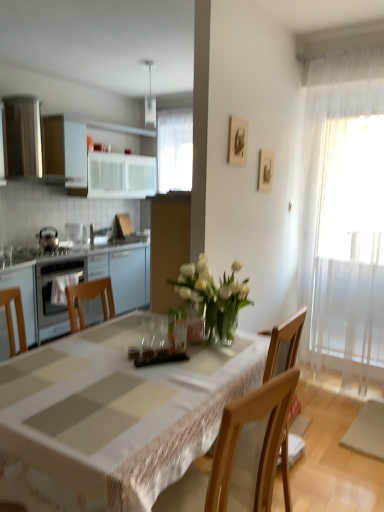
The width and height of the screenshot is (384, 512). What are the coordinates of `wooden picture frame at upper center, positioned as the 1th picture frame in left-to-right order` in the screenshot? It's located at (237, 141).

Find the location of `satin silver gas stove at left`. satin silver gas stove at left is located at coordinates (48, 251).

Identify the location of wooden chair at center. The width and height of the screenshot is (384, 512). (284, 340).

What do you see at coordinates (284, 340) in the screenshot?
I see `wooden chair at center` at bounding box center [284, 340].

This screenshot has width=384, height=512. Describe the element at coordinates (115, 415) in the screenshot. I see `white clothed table at center` at that location.

Measure the distance between white clothed table at center and camera.

1.07 meters.

This screenshot has width=384, height=512. What are the coordinates of `wooden picture frame at upper center, the 1th picture frame viewed from the front` in the screenshot? It's located at (237, 141).

From the image's perspective, which is below, wooden picture frame at upper right, the 2th picture frame when ordered from front to back, or white sheer curtain at right?

white sheer curtain at right.

Does point (265, 169) come in front of point (373, 91)?

That is True.

Which object is further away from the camera, wooden picture frame at upper right, the first picture frame in the right-to-left sequence, or white sheer curtain at right?

Positioned behind is wooden picture frame at upper right, the first picture frame in the right-to-left sequence.

Is wooden picture frame at upper right, marked as the first picture frame in a back-to-front arrangement, bigger or smaller than white sheer curtain at right?

Considering their sizes, wooden picture frame at upper right, marked as the first picture frame in a back-to-front arrangement, takes up less space than white sheer curtain at right.

Is white glass vase at center directly adjacent to satin silver oven at left?

No.

Can you confirm if white glass vase at center is wider than satin silver oven at left?

Indeed, white glass vase at center has a greater width compared to satin silver oven at left.

Is white glass vase at center positioned beyond the bounds of satin silver oven at left?

white glass vase at center lies outside satin silver oven at left's area.

Locate an element on the screen. The image size is (384, 512). floral arrangement that appears on the right of satin silver oven at left is located at coordinates (213, 297).

Which of these two, wooden chair at center or white glass vase at center, is thinner?

white glass vase at center is thinner.

Is point (273, 359) positioned behind point (174, 285)?

No, (273, 359) is closer to viewer.

Measure the distance from wooden chair at center to white glass vase at center.

wooden chair at center and white glass vase at center are 26.80 inches apart.

From the image's perspective, between wooden chair at center and white glass vase at center, which one is located above?

From the image's view, white glass vase at center is above.

Consider the image. Can you confirm if wooden picture frame at upper right, acting as the second picture frame starting from the left, is positioned to the left of wooden picture frame at upper center, placed as the second picture frame when sorted from back to front?

Incorrect, wooden picture frame at upper right, acting as the second picture frame starting from the left, is not on the left side of wooden picture frame at upper center, placed as the second picture frame when sorted from back to front.

Is the position of wooden picture frame at upper right, acting as the second picture frame starting from the left, less distant than that of wooden picture frame at upper center, which is counted as the 2th picture frame, starting from the right?

No, wooden picture frame at upper right, acting as the second picture frame starting from the left, is further to the viewer.

Considering the relative sizes of wooden picture frame at upper right, marked as the first picture frame in a back-to-front arrangement, and wooden picture frame at upper center, placed as the second picture frame when sorted from back to front, in the image provided, is wooden picture frame at upper right, marked as the first picture frame in a back-to-front arrangement, thinner than wooden picture frame at upper center, placed as the second picture frame when sorted from back to front,?

Indeed, wooden picture frame at upper right, marked as the first picture frame in a back-to-front arrangement, has a lesser width compared to wooden picture frame at upper center, placed as the second picture frame when sorted from back to front.

Is matte white cabinets at left, the first cabinetry positioned from the bottom, facing towards white clothed table at center?

Yes, matte white cabinets at left, the first cabinetry positioned from the bottom, is turned towards white clothed table at center.

Looking at this image, considering the sizes of objects matte white cabinets at left, the first cabinetry positioned from the bottom, and white clothed table at center in the image provided, who is wider, matte white cabinets at left, the first cabinetry positioned from the bottom, or white clothed table at center?

white clothed table at center.

This screenshot has width=384, height=512. Identify the location of table that is in front of the matte white cabinets at left, the first cabinetry positioned from the bottom. (115, 415).

Which of these two, satin silver oven at left or wooden picture frame at upper right, the first picture frame in the right-to-left sequence, stands shorter?

satin silver oven at left is shorter.

Can wooden picture frame at upper right, the first picture frame in the right-to-left sequence, be found inside satin silver oven at left?

Definitely not — wooden picture frame at upper right, the first picture frame in the right-to-left sequence, is not inside satin silver oven at left.

From a real-world perspective, which object rests below the other?

From a 3D spatial view, satin silver oven at left is below.

Considering the positions of point (82, 234) and point (118, 185), is point (82, 234) closer or farther from the camera than point (118, 185)?

Clearly, point (82, 234) is closer to the camera than point (118, 185).

Between satin silver oven at left and white glossy cabinets at upper left, the 2th cabinetry positioned from the bottom, which one has larger width?

With larger width is white glossy cabinets at upper left, the 2th cabinetry positioned from the bottom.

From a real-world perspective, which object stands above the other?

In real-world perspective, white glossy cabinets at upper left, the 1th cabinetry in the top-to-bottom sequence, is above.

Is satin silver oven at left oriented towards white glossy cabinets at upper left, the 1th cabinetry in the top-to-bottom sequence?

No, satin silver oven at left is not aimed at white glossy cabinets at upper left, the 1th cabinetry in the top-to-bottom sequence.

What are the coordinates of `picture frame that is the 1st object located above the white sheer curtain at right (from the image's perspective)` in the screenshot? It's located at (265, 170).

Locate an element on the screen. The height and width of the screenshot is (512, 384). appliance behind the white glass vase at center is located at coordinates (76, 233).

Considering their positions, is wooden chair at center positioned further to white sheer curtain at right than matte white cabinets at left, the first cabinetry positioned from the bottom?

matte white cabinets at left, the first cabinetry positioned from the bottom, lies further to white sheer curtain at right than the other object.

Looking at the image, which one is located further to wooden picture frame at upper center, placed as the second picture frame when sorted from back to front, satin silver gas stove at left or wooden chair at center?

satin silver gas stove at left lies further to wooden picture frame at upper center, placed as the second picture frame when sorted from back to front, than the other object.

Looking at the image, which one is located further to white clothed table at center, matte white cabinets at left, placed as the 2th cabinetry when sorted from top to bottom, or wooden picture frame at upper center, which is counted as the 2th picture frame, starting from the right?

matte white cabinets at left, placed as the 2th cabinetry when sorted from top to bottom, is further to white clothed table at center.

Based on their spatial positions, is white glass vase at center or white sheer curtain at right further from wooden chair at center?

white sheer curtain at right lies further to wooden chair at center than the other object.

Based on their spatial positions, is matte white cabinets at left, placed as the 2th cabinetry when sorted from top to bottom, or wooden picture frame at upper center, which is counted as the 2th picture frame, starting from the right, closer to satin silver gas stove at left?

matte white cabinets at left, placed as the 2th cabinetry when sorted from top to bottom, is positioned closer to the anchor satin silver gas stove at left.

From the image, which object appears to be nearer to wooden chair at center, satin silver oven at left or wooden picture frame at upper center, which is counted as the 2th picture frame, starting from the right?

wooden picture frame at upper center, which is counted as the 2th picture frame, starting from the right.

Considering their positions, is wooden picture frame at upper center, placed as the second picture frame when sorted from back to front, positioned further to white glossy cabinets at upper left, the 1th cabinetry in the top-to-bottom sequence, than wooden chair at center?

Based on the image, wooden chair at center appears to be further to white glossy cabinets at upper left, the 1th cabinetry in the top-to-bottom sequence.

Looking at the image, which one is located further to white sheer curtain at right, wooden chair at center or satin silver oven at left?

Among the two, satin silver oven at left is located further to white sheer curtain at right.

Where is `curtain between white clothed table at center and satin silver oven at left from front to back`? This screenshot has width=384, height=512. curtain between white clothed table at center and satin silver oven at left from front to back is located at coordinates (344, 214).

The height and width of the screenshot is (512, 384). In order to click on chair between white clothed table at center and satin silver gas stove at left in the front-back direction in this screenshot , I will do `click(284, 340)`.

Identify the location of appliance between white glossy cabinets at upper left, the 2th cabinetry positioned from the bottom, and satin silver oven at left in the up-down direction. This screenshot has height=512, width=384. (76, 233).

Image resolution: width=384 pixels, height=512 pixels. Identify the location of gas stove located between white clothed table at center and satin silver oven at left in the depth direction. (48, 251).